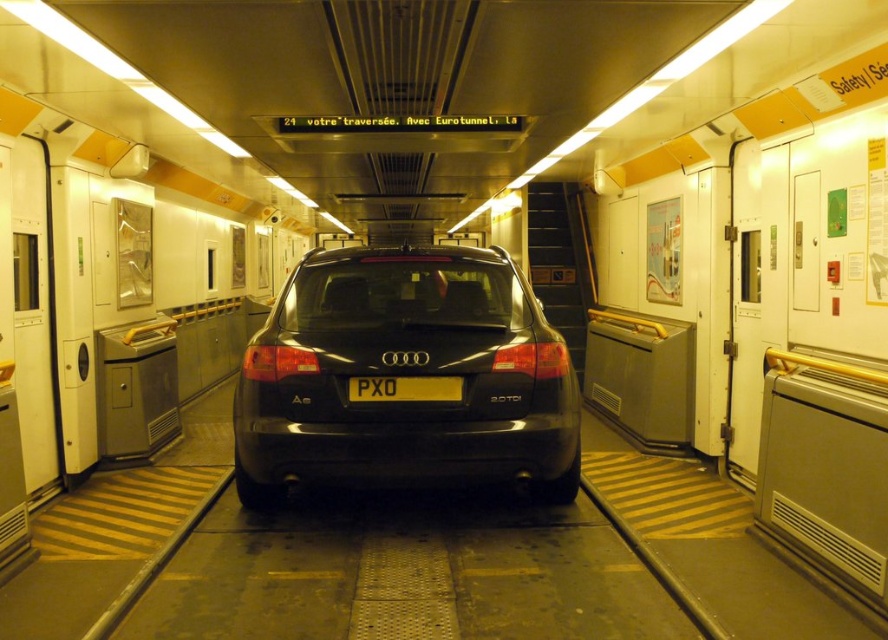
Question: Can you confirm if black matte/audi at center is positioned to the left of yellow matte license plate at center?

Choices:
 (A) yes
 (B) no

Answer: (A)

Question: Which object appears closest to the camera in this image?

Choices:
 (A) black matte/audi at center
 (B) yellow matte license plate at center

Answer: (A)

Question: Which point is farther to the camera?

Choices:
 (A) yellow matte license plate at center
 (B) black matte/audi at center

Answer: (A)

Question: Is black matte/audi at center to the right of yellow matte license plate at center from the viewer's perspective?

Choices:
 (A) yes
 (B) no

Answer: (B)

Question: Is black matte/audi at center smaller than yellow matte license plate at center?

Choices:
 (A) yes
 (B) no

Answer: (B)